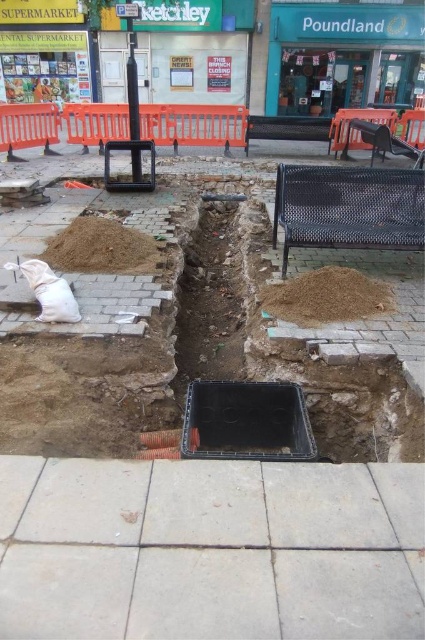
In the scene shown: You are a delivery driver who needs to park your van on the paved street near the construction site. The van requires a space that is wider than the brown sand at lower right. Is there enough space available on the brown dirt at left to park your van?

The brown dirt at left has a greater width than the brown sand at lower right, so yes, the van can park on the brown dirt at left since its width is sufficient.

You are a delivery driver who needs to park your truck between the brown sand at lower right and the brown dirt at left. The truck is 12 feet long. Will there be enough space between them to park the truck?

The brown sand at lower right and brown dirt at left are 4.10 feet apart from each other. Since the truck is 12 feet long, there is not enough space to park between them.